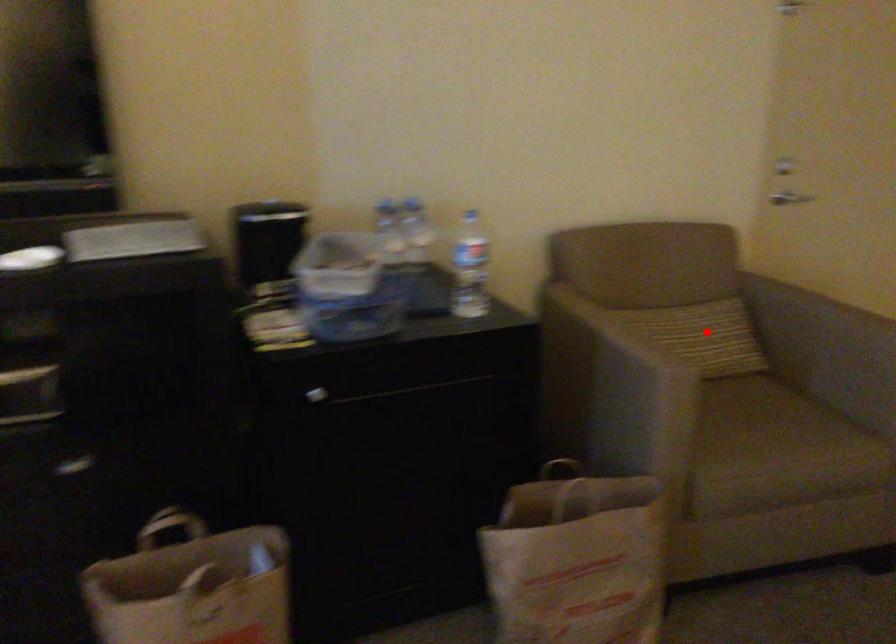
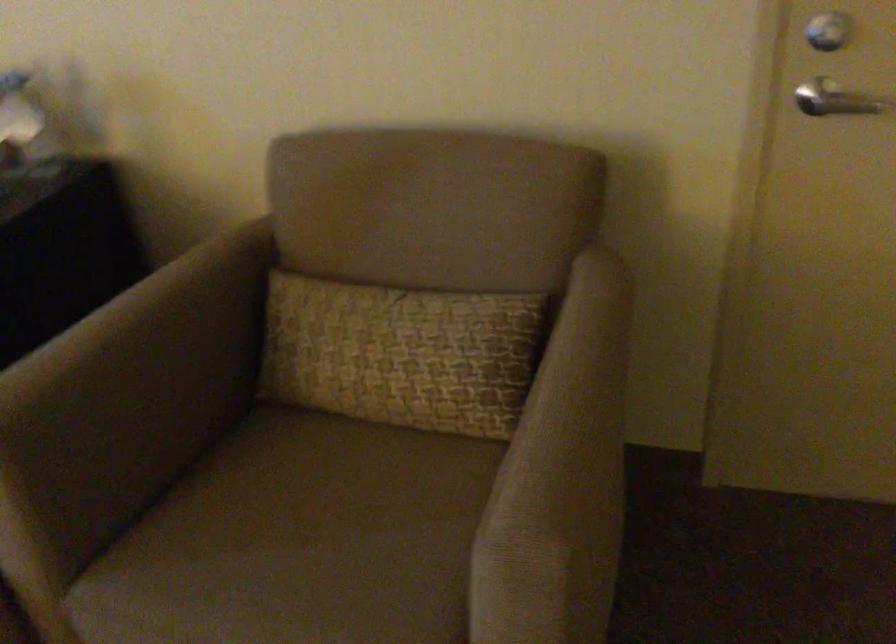
Question: I am providing you with two images of the same scene from different viewpoints. Given a red point in image1, look at the same physical point in image2. Is it:

Choices:
 (A) Closer to the viewpoint
 (B) Farther from the viewpoint

Answer: (A)